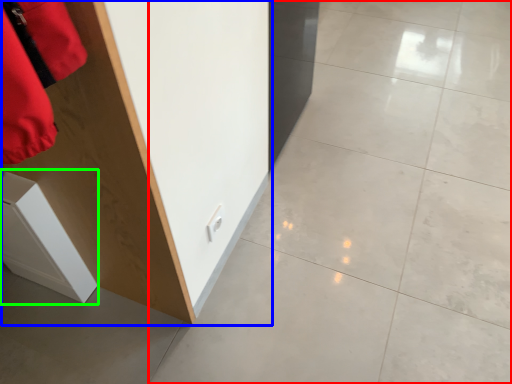
Question: Based on their relative distances, which object is farther from concrete (highlighted by a red box)? Choose from furniture (highlighted by a blue box) and cabinetry (highlighted by a green box).

Choices:
 (A) furniture
 (B) cabinetry

Answer: (B)